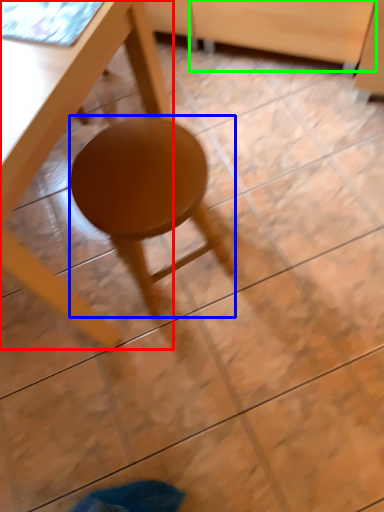
Question: Which is nearer to the table (highlighted by a red box)? stool (highlighted by a blue box) or drawer (highlighted by a green box).

Choices:
 (A) stool
 (B) drawer

Answer: (A)